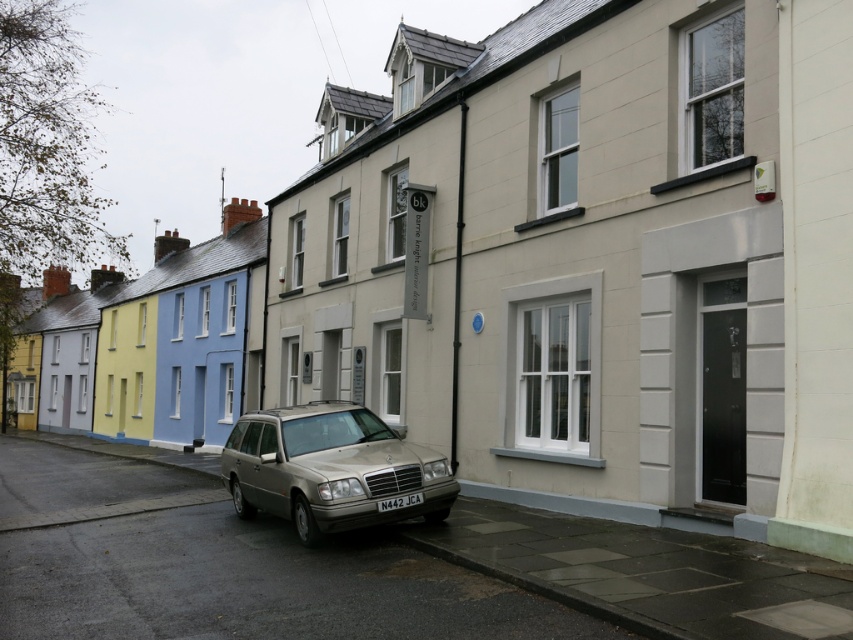
What do you see at coordinates (329, 468) in the screenshot?
I see `metallic silver station wagon at center` at bounding box center [329, 468].

Who is higher up, metallic silver station wagon at center or white plastic license plate at center?

Positioned higher is metallic silver station wagon at center.

Between point (335, 440) and point (387, 506), which one is positioned in front?

Positioned in front is point (387, 506).

Find the location of a particular element. This screenshot has height=640, width=853. metallic silver station wagon at center is located at coordinates (329, 468).